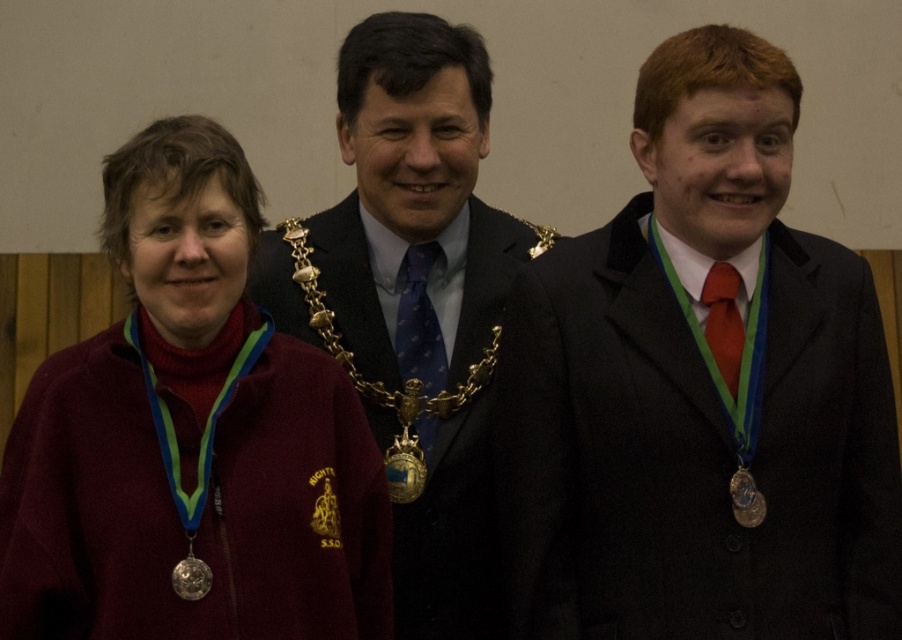
Question: Can you confirm if gold metallic chain at center is positioned to the left of blue satin tie at center?

Choices:
 (A) no
 (B) yes

Answer: (B)

Question: Which point appears closest to the camera in this image?

Choices:
 (A) click(192, 596)
 (B) click(733, 333)
 (C) click(419, 268)
 (D) click(190, 346)

Answer: (A)

Question: Among these points, which one is farthest from the camera?

Choices:
 (A) click(650, 621)
 (B) click(199, 337)
 (C) click(420, 394)

Answer: (C)

Question: Estimate the real-world distances between objects in this image. Which object is closer to the blue satin tie at center?

Choices:
 (A) gold metallic chain at center
 (B) metallic gold chain at center
 (C) matte red tie at right
 (D) matte black suit at center

Answer: (B)

Question: Does gold metallic chain at center appear under maroon fleece at center?

Choices:
 (A) yes
 (B) no

Answer: (B)

Question: Is maroon fleece jacket at left further to the viewer compared to matte red tie at right?

Choices:
 (A) no
 (B) yes

Answer: (A)